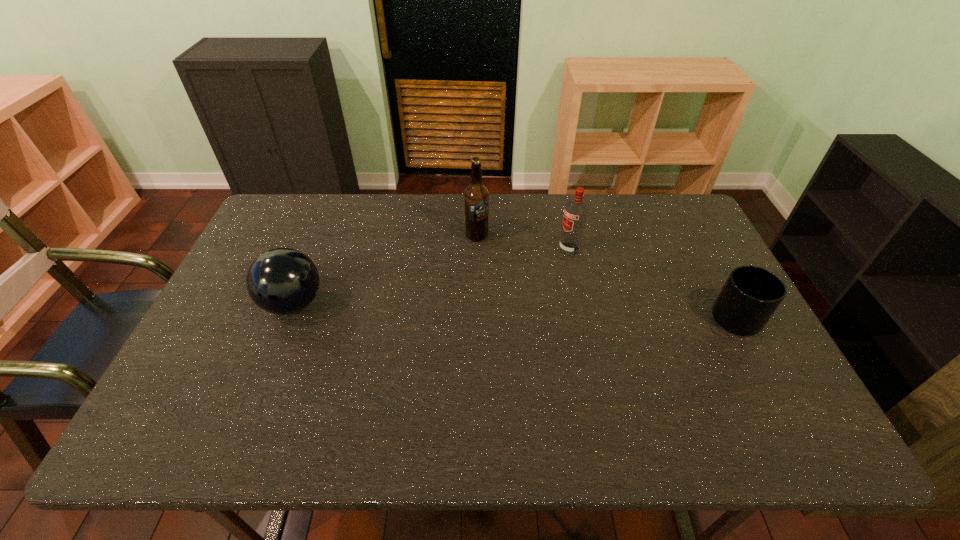
Locate an element on the screen. This screenshot has width=960, height=540. free space between the third tallest object and the second object from right to left is located at coordinates (431, 276).

Where is `empty space between the beer bottle and the leftmost object`? empty space between the beer bottle and the leftmost object is located at coordinates (385, 269).

At what (x,y) coordinates should I click in order to perform the action: click on vacant area that lies between the rightmost object and the leftmost object. Please return your answer as a coordinate pair (x, y). The width and height of the screenshot is (960, 540). Looking at the image, I should click on (518, 311).

Identify the location of free area in between the vodka and the leftmost object. (431, 276).

Where is `the third closest object relative to the mug`? the third closest object relative to the mug is located at coordinates pos(282,281).

Locate which object is the third closest to the bowling ball. Please provide its 2D coordinates. Your answer should be formatted as a tuple, i.e. [(x, y)], where the tuple contains the x and y coordinates of a point satisfying the conditions above.

[(750, 296)]